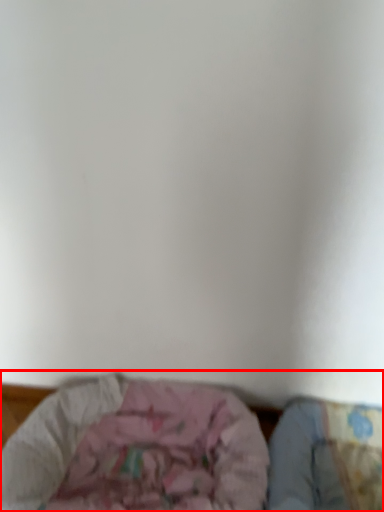
Question: Observing the image, what is the correct spatial positioning of furniture (annotated by the red box) in reference to sheet?

Choices:
 (A) right
 (B) left

Answer: (B)